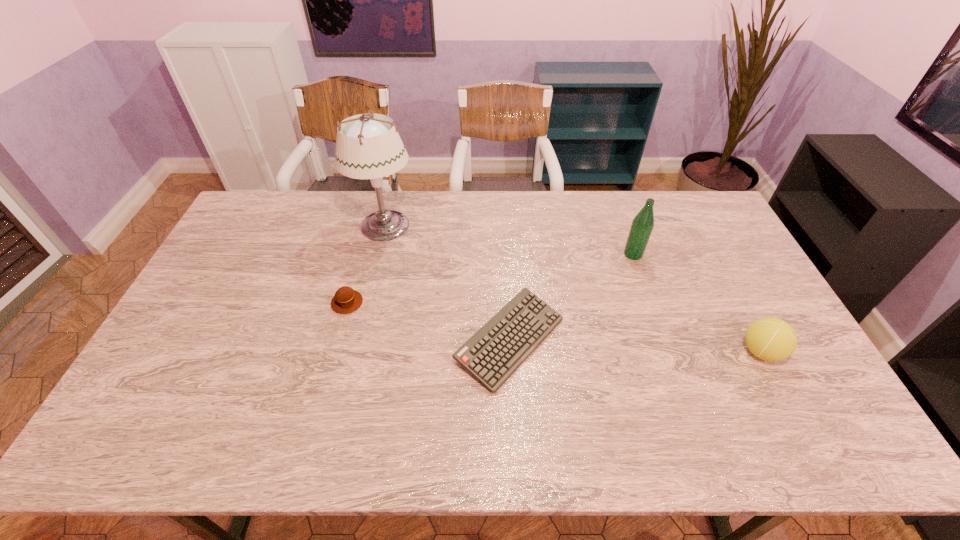
Where is `free space between the tallest object and the fourth shortest object`? free space between the tallest object and the fourth shortest object is located at coordinates (509, 240).

Locate an element on the screen. vacant space that's between the tallest object and the third tallest object is located at coordinates (573, 289).

At what (x,y) coordinates should I click in order to perform the action: click on free point between the tallest object and the muffin. Please return your answer as a coordinate pair (x, y). The width and height of the screenshot is (960, 540). Looking at the image, I should click on (366, 265).

I want to click on empty location between the lampshade and the tennis ball, so click(573, 289).

What are the coordinates of `vacant space in between the tallest object and the fourth shortest object` in the screenshot? It's located at (509, 240).

You are a GUI agent. You are given a task and a screenshot of the screen. Output one action in this format:
    pyautogui.click(x=<x>, y=<y>)
    Task: Click on the vacant space that is in between the muffin and the bottle
    The image size is (960, 540).
    Given the screenshot: What is the action you would take?
    pyautogui.click(x=491, y=278)

Locate an element on the screen. The image size is (960, 540). blank region between the muffin and the lampshade is located at coordinates (366, 265).

You are a GUI agent. You are given a task and a screenshot of the screen. Output one action in this format:
    pyautogui.click(x=<x>, y=<y>)
    Task: Click on the vacant space that is in between the third object from left to right and the third tallest object
    The width and height of the screenshot is (960, 540).
    Given the screenshot: What is the action you would take?
    pyautogui.click(x=636, y=346)

The height and width of the screenshot is (540, 960). I want to click on the fourth closest object to the lampshade, so click(771, 339).

Select which object appears as the third closest to the computer keyboard. Please provide its 2D coordinates. Your answer should be formatted as a tuple, i.e. [(x, y)], where the tuple contains the x and y coordinates of a point satisfying the conditions above.

[(642, 225)]